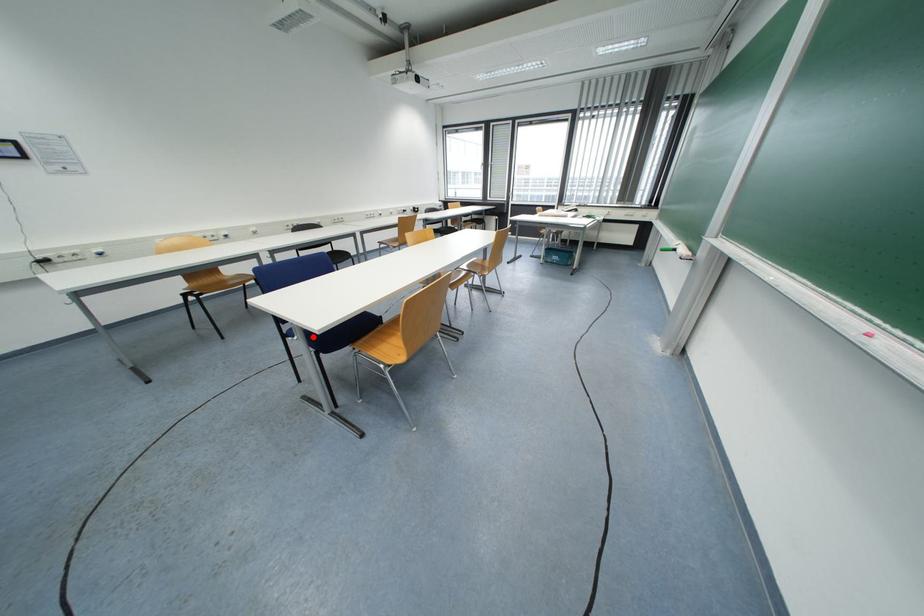
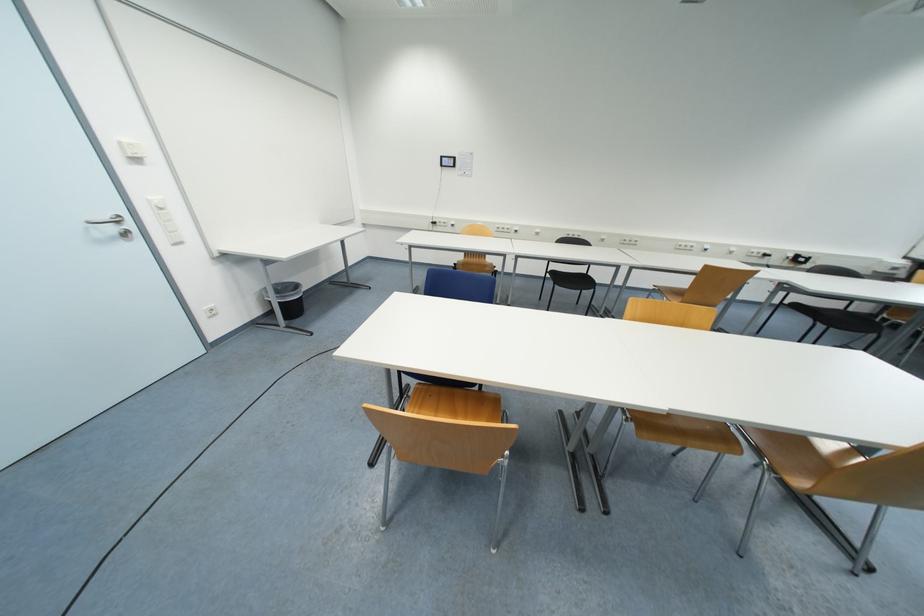
Question: I am providing you with two images of the same scene from different viewpoints. A red point is marked on the first image. Can you still see the location of the red point in image 2?

Choices:
 (A) Yes
 (B) No

Answer: (B)